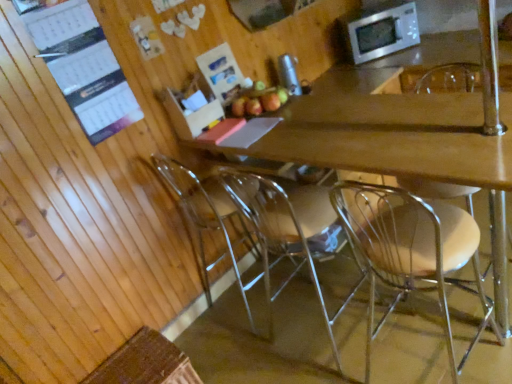
The width and height of the screenshot is (512, 384). Identify the location of vacant area on top of stainless steel microwave at upper right (from a real-world perspective). (371, 9).